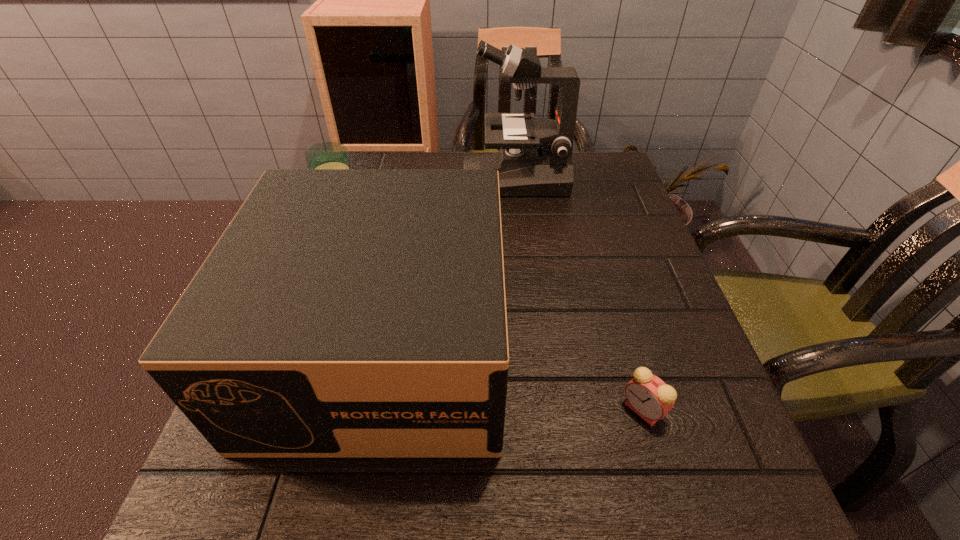
In the image, there is a desktop. What are the coordinates of `vacant region at the far edge` in the screenshot? It's located at (449, 159).

You are a GUI agent. You are given a task and a screenshot of the screen. Output one action in this format:
    pyautogui.click(x=<x>, y=<y>)
    Task: Click on the vacant area at the right edge of the desktop
    This screenshot has height=540, width=960.
    Given the screenshot: What is the action you would take?
    pyautogui.click(x=649, y=231)

Identify the location of vacant space at the far left corner. (372, 159).

Image resolution: width=960 pixels, height=540 pixels. Find the location of `vacant space at the near left corner of the desktop`. vacant space at the near left corner of the desktop is located at coordinates (304, 537).

Find the location of a particular element. Image resolution: width=960 pixels, height=540 pixels. free space between the shortest object and the microscope is located at coordinates (579, 294).

Identify the location of free spot between the alarm clock and the third shortest object. (513, 377).

At what (x,y) coordinates should I click in order to perform the action: click on free space between the box and the shortest object. Please return your answer as a coordinate pair (x, y). This screenshot has height=540, width=960. Looking at the image, I should click on (513, 377).

Choose which object is the third nearest neighbor to the farthest object. Please provide its 2D coordinates. Your answer should be formatted as a tuple, i.e. [(x, y)], where the tuple contains the x and y coordinates of a point satisfying the conditions above.

[(648, 396)]

Locate an element on the screen. This screenshot has width=960, height=540. object that is the third closest to the farthest object is located at coordinates (648, 396).

I want to click on blank space that satisfies the following two spatial constraints: 1. through the eyepieces of the tallest object; 2. on the front side of the third tallest object, so click(518, 211).